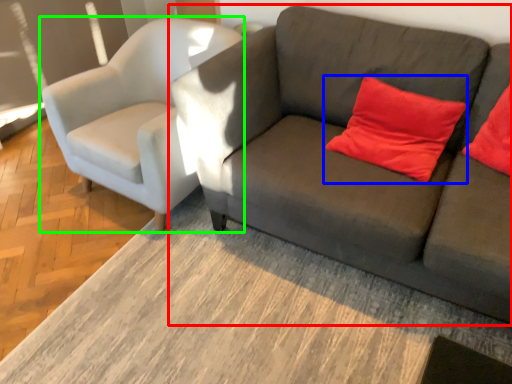
Question: Considering the real-world distances, which object is farthest from studio couch (highlighted by a red box)? pillow (highlighted by a blue box) or chair (highlighted by a green box)?

Choices:
 (A) pillow
 (B) chair

Answer: (B)